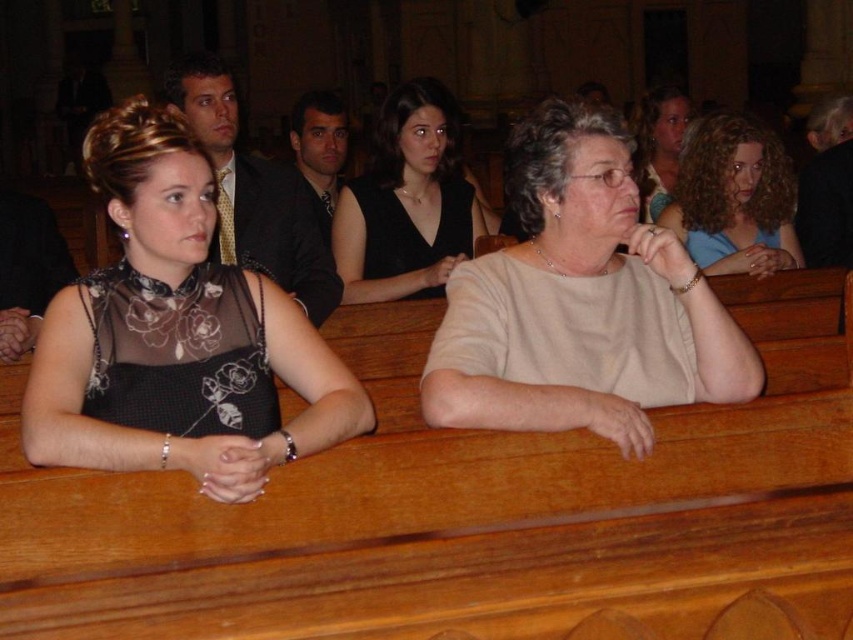
Between curly hair at upper right and matte black dress at upper center, which one has more height?

matte black dress at upper center

Does curly hair at upper right appear on the left side of matte black dress at upper center?

Indeed, curly hair at upper right is positioned on the left side of matte black dress at upper center.

Find the location of a particular element. Image resolution: width=853 pixels, height=640 pixels. curly hair at upper right is located at coordinates (734, 198).

At what (x,y) coordinates should I click in order to perform the action: click on curly hair at upper right. Please return your answer as a coordinate pair (x, y). The height and width of the screenshot is (640, 853). Looking at the image, I should click on (734, 198).

Is point (96, 131) closer to camera compared to point (675, 227)?

Yes.

Who is positioned more to the right, black sheer dress at center or curly hair at upper right?

From the viewer's perspective, curly hair at upper right appears more on the right side.

Which is in front, point (213, 344) or point (722, 182)?

Point (213, 344) is more forward.

Find the location of a particular element. This screenshot has width=853, height=640. black sheer dress at center is located at coordinates (177, 333).

Can you confirm if beige cotton shirt at center is taller than matte black dress at upper center?

No, beige cotton shirt at center is not taller than matte black dress at upper center.

Is beige cotton shirt at center bigger than matte black dress at upper center?

No.

Which is behind, point (593, 244) or point (688, 116)?

Point (688, 116)

Locate an element on the screen. beige cotton shirt at center is located at coordinates (579, 301).